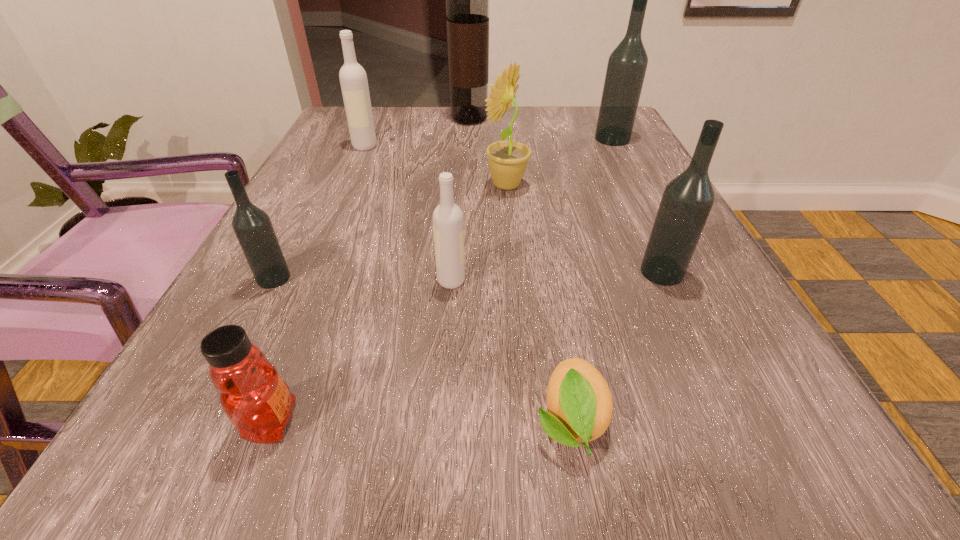
Image resolution: width=960 pixels, height=540 pixels. I want to click on the farthest object, so click(x=467, y=0).

This screenshot has height=540, width=960. Identify the location of the tallest object. (467, 0).

Where is `the biggest black vodka`? the biggest black vodka is located at coordinates (627, 64).

Locate an element on the screen. Image resolution: width=960 pixels, height=540 pixels. the second tallest object is located at coordinates (627, 64).

The width and height of the screenshot is (960, 540). Find the location of `the bigger white vodka`. the bigger white vodka is located at coordinates (353, 79).

Find the location of a particular element. This screenshot has height=540, width=960. the second vodka from left to right is located at coordinates (353, 79).

The image size is (960, 540). Identify the location of the second smallest black vodka. (687, 200).

This screenshot has height=540, width=960. I want to click on sunflower, so click(x=508, y=160).

Where is `yellow sunflower`? yellow sunflower is located at coordinates (508, 160).

Where is `the third vodka from right to left`? Image resolution: width=960 pixels, height=540 pixels. the third vodka from right to left is located at coordinates (448, 226).